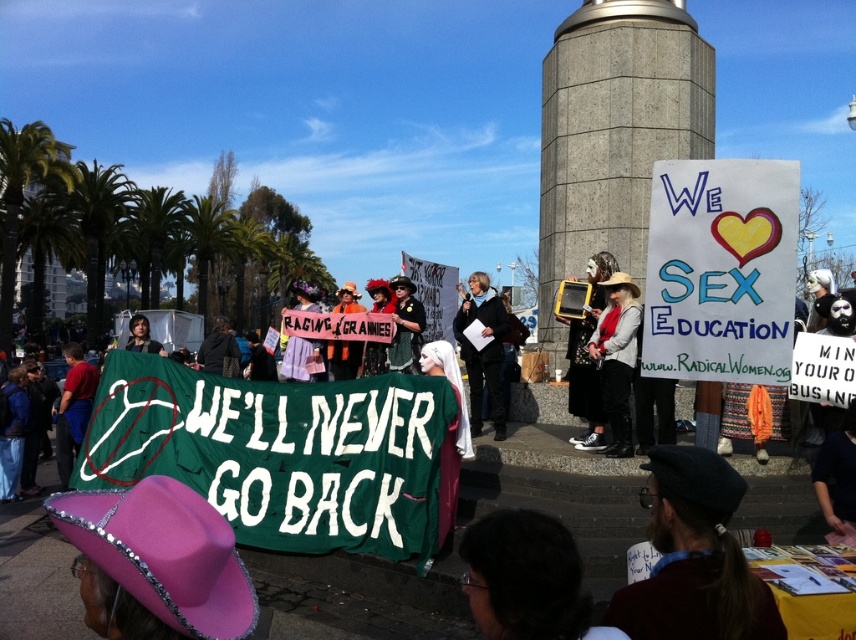
From the picture: You are a photographer standing in the crowd at the protest. You want to take a picture of the white knit sweater at center and the brown wool beret at lower center. Which object is positioned to the left of the other?

The brown wool beret at lower center is to the left of the white knit sweater at center.

You are a photographer trying to capture a closeup of the yellow plastic sign at center without including the brown wool beret at lower center in the frame. Is this possible given their sizes?

The brown wool beret at lower center occupies less space than the yellow plastic sign at center. Since the beret is smaller, it can be positioned out of the frame while keeping the sign centered, making it possible to capture the closeup without including the beret.